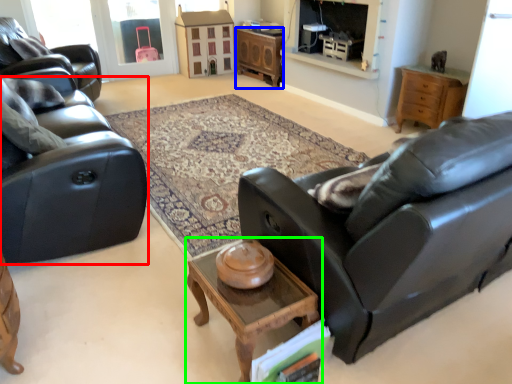
Question: Considering the real-world distances, which object is closest to studio couch (highlighted by a red box)? desk (highlighted by a blue box) or coffee table (highlighted by a green box).

Choices:
 (A) desk
 (B) coffee table

Answer: (B)